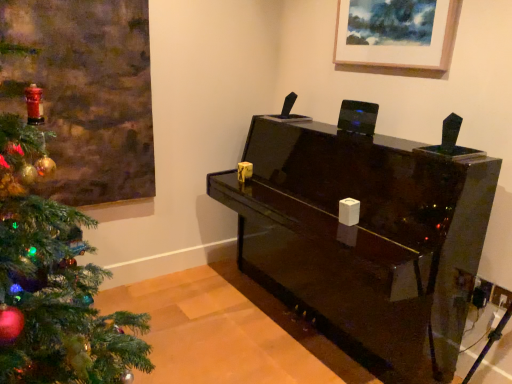
Question: From the image's perspective, is glossy black piano at center on wooden picture frame at upper center?

Choices:
 (A) yes
 (B) no

Answer: (B)

Question: Does glossy black piano at center have a greater width compared to wooden picture frame at upper center?

Choices:
 (A) yes
 (B) no

Answer: (A)

Question: Are glossy black piano at center and wooden picture frame at upper center making contact?

Choices:
 (A) no
 (B) yes

Answer: (A)

Question: Would you say glossy black piano at center is a long distance from wooden picture frame at upper center?

Choices:
 (A) yes
 (B) no

Answer: (B)

Question: Is glossy black piano at center outside of wooden picture frame at upper center?

Choices:
 (A) yes
 (B) no

Answer: (A)

Question: Can you confirm if glossy black piano at center is taller than wooden picture frame at upper center?

Choices:
 (A) yes
 (B) no

Answer: (A)

Question: Is wooden picture frame at upper center wider than glossy black piano at center?

Choices:
 (A) yes
 (B) no

Answer: (B)

Question: Can you confirm if wooden picture frame at upper center is positioned to the left of glossy black piano at center?

Choices:
 (A) no
 (B) yes

Answer: (A)

Question: Does wooden picture frame at upper center have a lesser height compared to glossy black piano at center?

Choices:
 (A) no
 (B) yes

Answer: (B)

Question: Considering the relative sizes of wooden picture frame at upper center and glossy black piano at center in the image provided, is wooden picture frame at upper center taller than glossy black piano at center?

Choices:
 (A) no
 (B) yes

Answer: (A)

Question: Is wooden picture frame at upper center positioned beyond the bounds of glossy black piano at center?

Choices:
 (A) no
 (B) yes

Answer: (B)

Question: Considering the relative sizes of wooden picture frame at upper center and glossy black piano at center in the image provided, is wooden picture frame at upper center smaller than glossy black piano at center?

Choices:
 (A) no
 (B) yes

Answer: (B)

Question: Is wooden picture frame at upper center in front of or behind glossy black piano at center in the image?

Choices:
 (A) behind
 (B) front

Answer: (A)